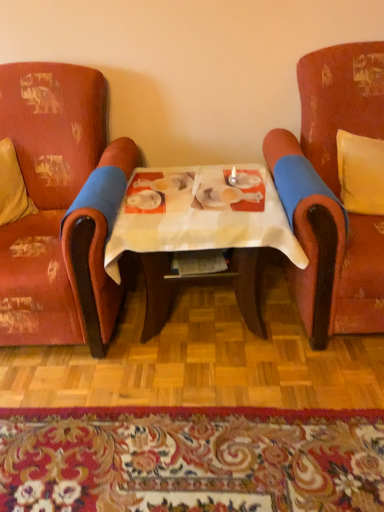
Find the location of `empty space that is ontop of floral carpet at lower center`. empty space that is ontop of floral carpet at lower center is located at coordinates (174, 454).